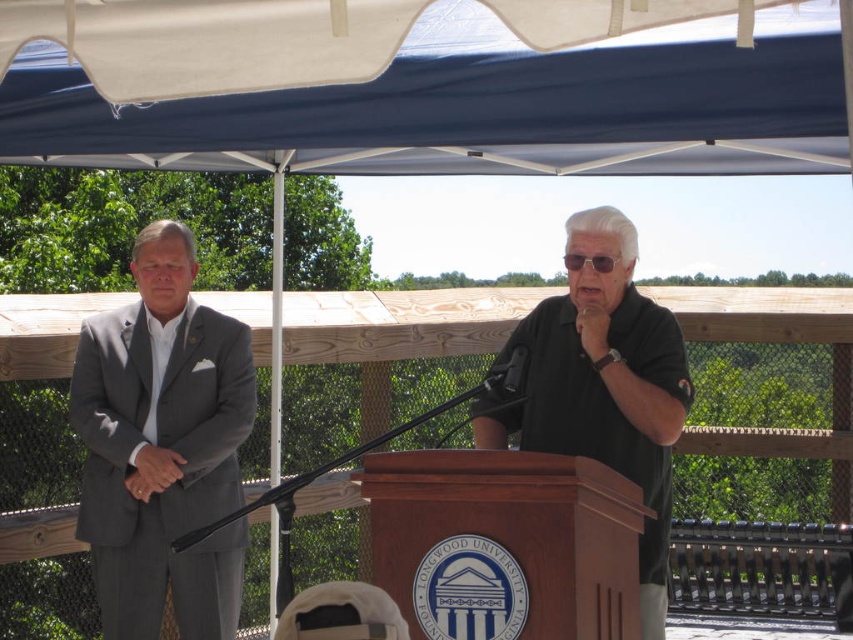
In the scene shown: Can you confirm if white fabric canopy at upper center is taller than black matte shirt at center?

In fact, white fabric canopy at upper center may be shorter than black matte shirt at center.

Measure the distance between point (698, 22) and camera.

The distance of point (698, 22) from camera is 3.15 meters.

Does point (320, 129) come behind point (679, 413)?

Yes.

Where is `white fabric canopy at upper center`? white fabric canopy at upper center is located at coordinates (479, 106).

Can you confirm if gray suit at left is positioned below black matte shirt at center?

Yes, gray suit at left is below black matte shirt at center.

Which of these two, gray suit at left or black matte shirt at center, stands shorter?

With less height is black matte shirt at center.

Locate an element on the screen. gray suit at left is located at coordinates (161, 445).

The image size is (853, 640). I want to click on gray suit at left, so click(161, 445).

Who is higher up, white fabric canopy at upper center or gray suit at left?

white fabric canopy at upper center

Who is more forward, (364, 152) or (141, 497)?

Point (141, 497) is more forward.

Find the location of a particular element. The width and height of the screenshot is (853, 640). white fabric canopy at upper center is located at coordinates (479, 106).